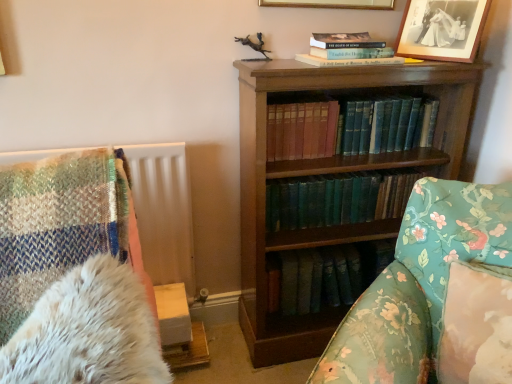
What is the approximate height of green leather book at center, the 1th book from the bottom?

7.58 inches.

Image resolution: width=512 pixels, height=384 pixels. Describe the element at coordinates (442, 29) in the screenshot. I see `black matte picture frame at upper right, the second picture frame positioned from the left` at that location.

The image size is (512, 384). What do you see at coordinates (435, 295) in the screenshot?
I see `dark green leather bookshelf at center` at bounding box center [435, 295].

At what (x,y) coordinates should I click in order to perform the action: click on gold-framed picture at upper center, which appears as the second picture frame when viewed from the right. Please return your answer as a coordinate pair (x, y). The height and width of the screenshot is (384, 512). Looking at the image, I should click on click(331, 4).

The image size is (512, 384). Describe the element at coordinates (331, 4) in the screenshot. I see `gold-framed picture at upper center, which appears as the second picture frame when viewed from the right` at that location.

Where is `green leather book at center, the 1th book from the bottom`? green leather book at center, the 1th book from the bottom is located at coordinates (337, 199).

Can we say fluffy white pillow at lower right lies outside green leather book at center, the 1th book from the bottom?

Yes, fluffy white pillow at lower right is not within green leather book at center, the 1th book from the bottom.

Looking at this image, from the image's perspective, between fluffy white pillow at lower right and green leather book at center, placed as the second book when sorted from top to bottom, who is located below?

From the image's view, fluffy white pillow at lower right is below.

Which of these two, fluffy white pillow at lower right or green leather book at center, the 1th book from the bottom, is thinner?

With smaller width is green leather book at center, the 1th book from the bottom.

Can you tell me how much fluffy white pillow at lower right and green leather book at center, placed as the second book when sorted from top to bottom, differ in facing direction?

fluffy white pillow at lower right and green leather book at center, placed as the second book when sorted from top to bottom, are facing 39.1 degrees away from each other.

Would you consider white fur at lower left to be distant from wooden bookcase at center?

No, white fur at lower left is in close proximity to wooden bookcase at center.

Would you say white fur at lower left contains wooden bookcase at center?

No.

Looking at this image, how different are the orientations of white fur at lower left and wooden bookcase at center in degrees?

There is a 11.3-degree angle between the facing directions of white fur at lower left and wooden bookcase at center.

Is wooden bookcase at center at the back of white fur at lower left?

No, white fur at lower left's orientation is not away from wooden bookcase at center.

From the picture: From the image's perspective, is teal leather book at center, acting as the 1th book starting from the top, beneath gold-framed picture at upper center, which appears as the second picture frame when viewed from the right?

Yes, from the image's perspective, teal leather book at center, acting as the 1th book starting from the top, is below gold-framed picture at upper center, which appears as the second picture frame when viewed from the right.

Which of these two, teal leather book at center, arranged as the second book when ordered from the bottom, or gold-framed picture at upper center, acting as the first picture frame starting from the left, is thinner?

Thinner between the two is gold-framed picture at upper center, acting as the first picture frame starting from the left.

Is teal leather book at center, acting as the 1th book starting from the top, in front of or behind gold-framed picture at upper center, which appears as the second picture frame when viewed from the right, in the image?

teal leather book at center, acting as the 1th book starting from the top, is behind gold-framed picture at upper center, which appears as the second picture frame when viewed from the right.

Is teal leather book at center, arranged as the second book when ordered from the bottom, to the left of gold-framed picture at upper center, acting as the first picture frame starting from the left, from the viewer's perspective?

Incorrect, teal leather book at center, arranged as the second book when ordered from the bottom, is not on the left side of gold-framed picture at upper center, acting as the first picture frame starting from the left.

How different are the orientations of green leather book at center, placed as the second book when sorted from top to bottom, and teal leather book at center, arranged as the second book when ordered from the bottom, in degrees?

The angular difference between green leather book at center, placed as the second book when sorted from top to bottom, and teal leather book at center, arranged as the second book when ordered from the bottom, is 0.0014 degrees.

Does green leather book at center, the 1th book from the bottom, have a larger size compared to teal leather book at center, acting as the 1th book starting from the top?

Actually, green leather book at center, the 1th book from the bottom, might be smaller than teal leather book at center, acting as the 1th book starting from the top.

Is green leather book at center, the 1th book from the bottom, inside or outside of teal leather book at center, acting as the 1th book starting from the top?

The correct answer is: outside.

From a real-world perspective, which object rests below the other?

From a 3D spatial view, white fur at lower left is below.

Which of these two, white fur at lower left or gold-framed picture at upper center, acting as the first picture frame starting from the left, is thinner?

gold-framed picture at upper center, acting as the first picture frame starting from the left.

Would you say white fur at lower left is to the left or to the right of gold-framed picture at upper center, which appears as the second picture frame when viewed from the right, in the picture?

Clearly, white fur at lower left is on the left of gold-framed picture at upper center, which appears as the second picture frame when viewed from the right, in the image.

From the image's perspective, which is above, white fur at lower left or gold-framed picture at upper center, which appears as the second picture frame when viewed from the right?

From the image's view, gold-framed picture at upper center, which appears as the second picture frame when viewed from the right, is above.

Considering the relative sizes of wooden bookcase at center and black matte picture frame at upper right, the first picture frame viewed from the right, in the image provided, is wooden bookcase at center bigger than black matte picture frame at upper right, the first picture frame viewed from the right,?

Correct, wooden bookcase at center is larger in size than black matte picture frame at upper right, the first picture frame viewed from the right.

Would you say wooden bookcase at center is a long distance from black matte picture frame at upper right, the second picture frame positioned from the left?

No, there isn't a large distance between wooden bookcase at center and black matte picture frame at upper right, the second picture frame positioned from the left.

From a real-world perspective, is wooden bookcase at center beneath black matte picture frame at upper right, the first picture frame viewed from the right?

Correct, in the physical world, wooden bookcase at center is lower than black matte picture frame at upper right, the first picture frame viewed from the right.

Is fluffy white pillow at lower right at the back of teal leather book at center, acting as the 1th book starting from the top?

No, teal leather book at center, acting as the 1th book starting from the top, is not facing the opposite direction of fluffy white pillow at lower right.

Is teal leather book at center, arranged as the second book when ordered from the bottom, beside fluffy white pillow at lower right?

teal leather book at center, arranged as the second book when ordered from the bottom, and fluffy white pillow at lower right are clearly separated.

From a real-world perspective, who is located lower, teal leather book at center, acting as the 1th book starting from the top, or fluffy white pillow at lower right?

fluffy white pillow at lower right, from a real-world perspective.

Choose the correct answer: Is teal leather book at center, acting as the 1th book starting from the top, inside fluffy white pillow at lower right or outside it?

teal leather book at center, acting as the 1th book starting from the top, cannot be found inside fluffy white pillow at lower right.

The height and width of the screenshot is (384, 512). Identify the location of the 2nd book behind the fluffy white pillow at lower right, starting your count from the anchor. (337, 199).

The width and height of the screenshot is (512, 384). What are the coordinates of `chiffonier that appears above the wooden bookcase at center (from a real-world perspective)` in the screenshot? It's located at (88, 331).

From the image, which object appears to be farther from wooden bookcase at center, fluffy white pillow at lower right or gold-framed picture at upper center, acting as the first picture frame starting from the left?

fluffy white pillow at lower right lies further to wooden bookcase at center than the other object.

When comparing their distances from black matte picture frame at upper right, the first picture frame viewed from the right, does wooden bookcase at center or gold-framed picture at upper center, which appears as the second picture frame when viewed from the right, seem further?

wooden bookcase at center.

Estimate the real-world distances between objects in this image. Which object is closer to white fur at lower left, dark green leather bookshelf at center or teal leather book at center, acting as the 1th book starting from the top?

Based on the image, dark green leather bookshelf at center appears to be nearer to white fur at lower left.

Based on their spatial positions, is teal leather book at center, arranged as the second book when ordered from the bottom, or fluffy white pillow at lower right closer to white fur at lower left?

The object closer to white fur at lower left is fluffy white pillow at lower right.

Estimate the real-world distances between objects in this image. Which object is closer to white fur at lower left, fluffy white pillow at lower right or green leather book at center, placed as the second book when sorted from top to bottom?

fluffy white pillow at lower right lies closer to white fur at lower left than the other object.

Considering their positions, is teal leather book at center, acting as the 1th book starting from the top, positioned closer to dark green leather bookshelf at center than wooden bookcase at center?

Among the two, wooden bookcase at center is located nearer to dark green leather bookshelf at center.

Which object lies nearer to the anchor point black matte picture frame at upper right, the first picture frame viewed from the right, dark green leather bookshelf at center or fluffy white pillow at lower right?

dark green leather bookshelf at center lies closer to black matte picture frame at upper right, the first picture frame viewed from the right, than the other object.

When comparing their distances from teal leather book at center, acting as the 1th book starting from the top, does black matte picture frame at upper right, the second picture frame positioned from the left, or wooden bookcase at center seem further?

Among the two, black matte picture frame at upper right, the second picture frame positioned from the left, is located further to teal leather book at center, acting as the 1th book starting from the top.

The width and height of the screenshot is (512, 384). Find the location of `picture frame between gold-framed picture at upper center, acting as the first picture frame starting from the left, and wooden bookcase at center, in the vertical direction`. picture frame between gold-framed picture at upper center, acting as the first picture frame starting from the left, and wooden bookcase at center, in the vertical direction is located at coordinates (442, 29).

Locate an element on the screen. The image size is (512, 384). bookcase located between white fur at lower left and black matte picture frame at upper right, the second picture frame positioned from the left, in the left-right direction is located at coordinates (327, 174).

Identify the location of bookcase between black matte picture frame at upper right, the second picture frame positioned from the left, and fluffy white pillow at lower right from top to bottom. The image size is (512, 384). (327, 174).

Find the location of a particular element. book between teal leather book at center, arranged as the second book when ordered from the bottom, and wooden bookcase at center in the up-down direction is located at coordinates (337, 199).